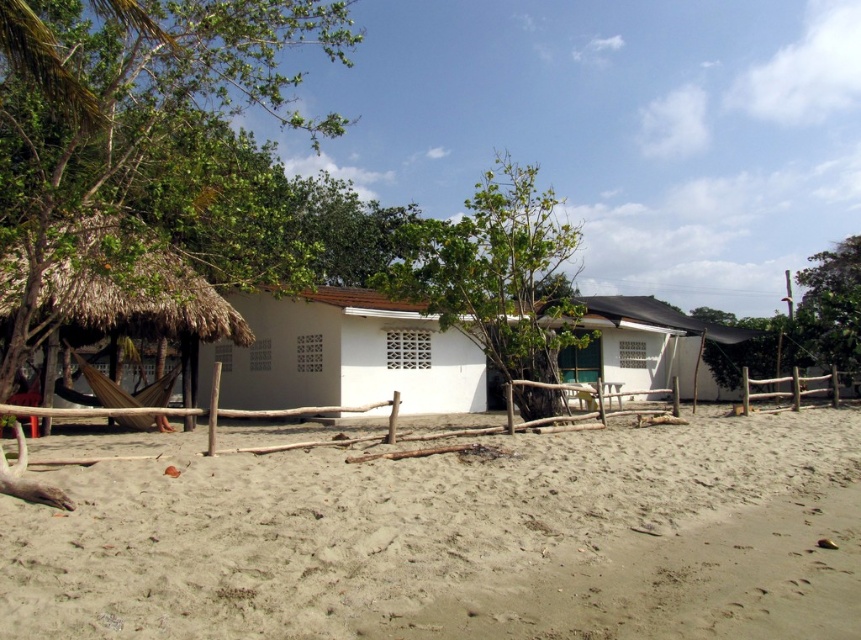
Based on the photo, you are planning to set up a picnic blanket between the green leafy tree at left and the thatched straw hut at left. Which object should you place the blanket closer to to ensure it is wider and provide more shade?

The green leafy tree at left might be wider than the thatched straw hut at left, so placing the picnic blanket closer to the green leafy tree at left would likely offer more shade.

You are standing on the beach and want to walk from the light beige sand at lower center to the green leafy tree at upper right. Which direction should you head to reach the tree?

To reach the green leafy tree at upper right from the light beige sand at lower center, you should head to the right since the tree is located to the right of the sand area.

You are standing at the beach and want to walk from the light beige sand at lower center to the green leafy tree at upper right. Which direction should you move to reach the tree?

To reach the green leafy tree at upper right, you should move upward from the light beige sand at lower center since the tree is positioned above the sand in the image.